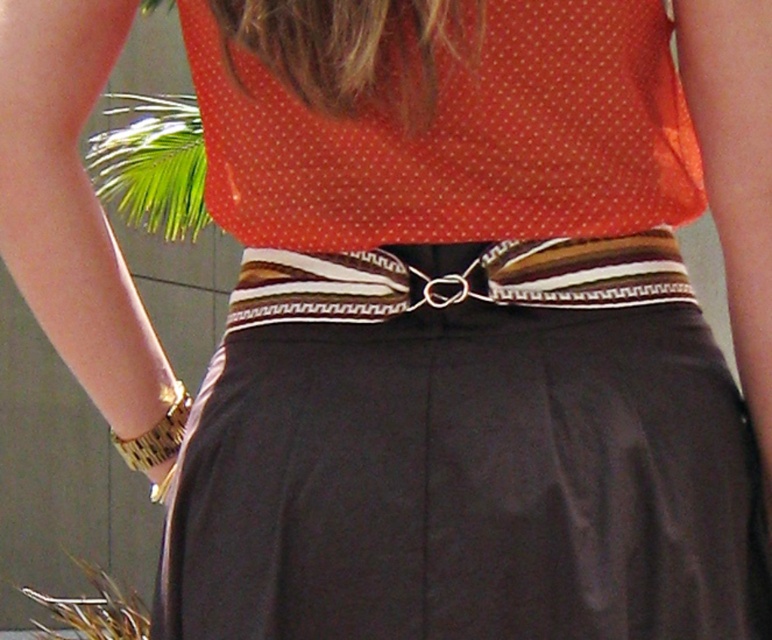
Question: Which point is closer to the camera?

Choices:
 (A) (178, 388)
 (B) (219, 193)
 (C) (434, 282)

Answer: (C)

Question: Observing the image, what is the correct spatial positioning of striped fabric belt at center in reference to gold metallic bracelet at lower left?

Choices:
 (A) above
 (B) below

Answer: (A)

Question: Can you confirm if striped fabric belt at center is positioned above gold metallic bracelet at lower left?

Choices:
 (A) no
 (B) yes

Answer: (B)

Question: Which object is closer to the camera taking this photo?

Choices:
 (A) orange dotted fabric at upper center
 (B) gold metallic bracelet at lower left
 (C) striped fabric belt at center

Answer: (A)

Question: Does orange dotted fabric at upper center have a smaller size compared to striped fabric belt at center?

Choices:
 (A) no
 (B) yes

Answer: (A)

Question: Which of the following is the closest to the observer?

Choices:
 (A) (166, 456)
 (B) (202, 70)
 (C) (608, 264)

Answer: (C)